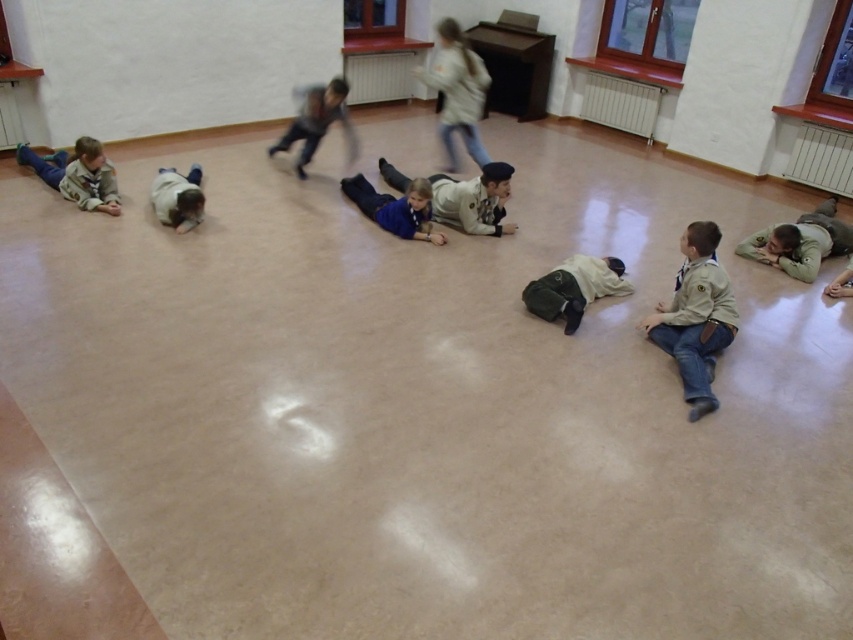
The width and height of the screenshot is (853, 640). I want to click on khaki uniform at lower right, so click(x=695, y=316).

Can you confirm if khaki uniform at lower right is positioned above light brown uniform at left?

No, khaki uniform at lower right is not above light brown uniform at left.

Locate an element on the screen. khaki uniform at lower right is located at coordinates (695, 316).

Can you confirm if dark green uniform at center is positioned to the right of blue matte shirt at center?

Indeed, dark green uniform at center is positioned on the right side of blue matte shirt at center.

Does dark green uniform at center have a larger size compared to blue matte shirt at center?

Actually, dark green uniform at center might be smaller than blue matte shirt at center.

Locate an element on the screen. This screenshot has height=640, width=853. dark green uniform at center is located at coordinates (573, 289).

The width and height of the screenshot is (853, 640). I want to click on dark green uniform at center, so click(573, 289).

Which is below, light brown uniform at left or blue matte shirt at center?

blue matte shirt at center is lower down.

Does light brown uniform at left have a smaller size compared to blue matte shirt at center?

No, light brown uniform at left is not smaller than blue matte shirt at center.

Image resolution: width=853 pixels, height=640 pixels. What do you see at coordinates (77, 173) in the screenshot?
I see `light brown uniform at left` at bounding box center [77, 173].

Locate an element on the screen. The image size is (853, 640). light brown uniform at left is located at coordinates 77,173.